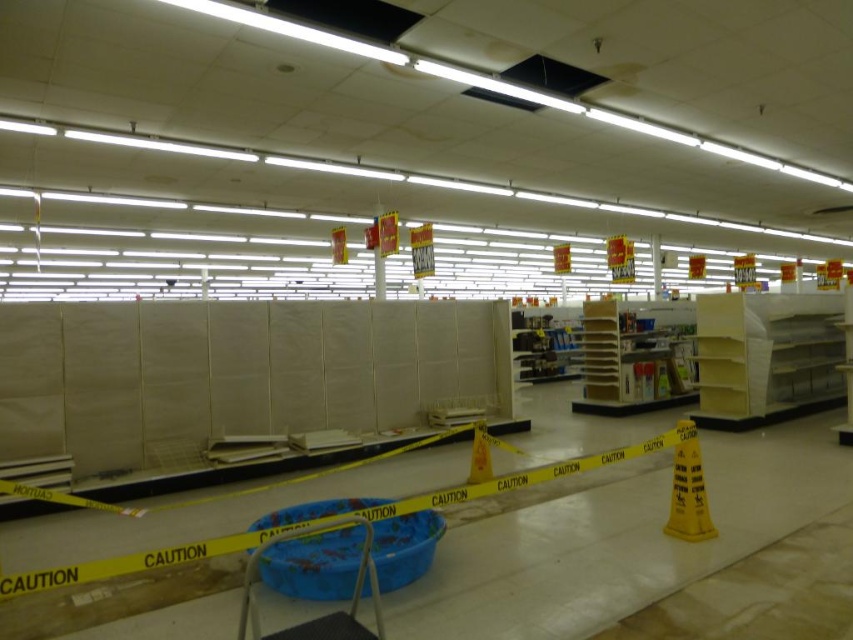
Question: Based on their relative distances, which object is farther from the yellow matte shelf at center?

Choices:
 (A) wooden shelves at center
 (B) yellow plastic cone at center

Answer: (B)

Question: Which of the following is the farthest from the observer?

Choices:
 (A) yellow plastic cone at center
 (B) yellow matte shelf at center
 (C) yellow caution cone at lower right
 (D) wooden shelves at center

Answer: (D)

Question: Is wooden shelves at center bigger than yellow caution cone at lower right?

Choices:
 (A) no
 (B) yes

Answer: (B)

Question: Is wooden shelves at center below yellow caution cone at lower right?

Choices:
 (A) yes
 (B) no

Answer: (B)

Question: Is yellow matte shelf at center positioned before yellow plastic cone at center?

Choices:
 (A) no
 (B) yes

Answer: (A)

Question: Which of the following is the farthest from the observer?

Choices:
 (A) (474, 483)
 (B) (699, 296)
 (C) (688, 531)
 (D) (654, 349)

Answer: (D)